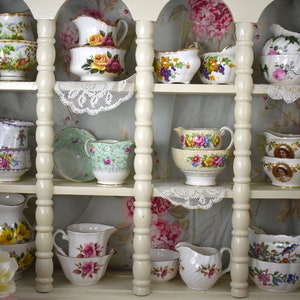
I want to click on cup that tipped over, so tap(66, 160).